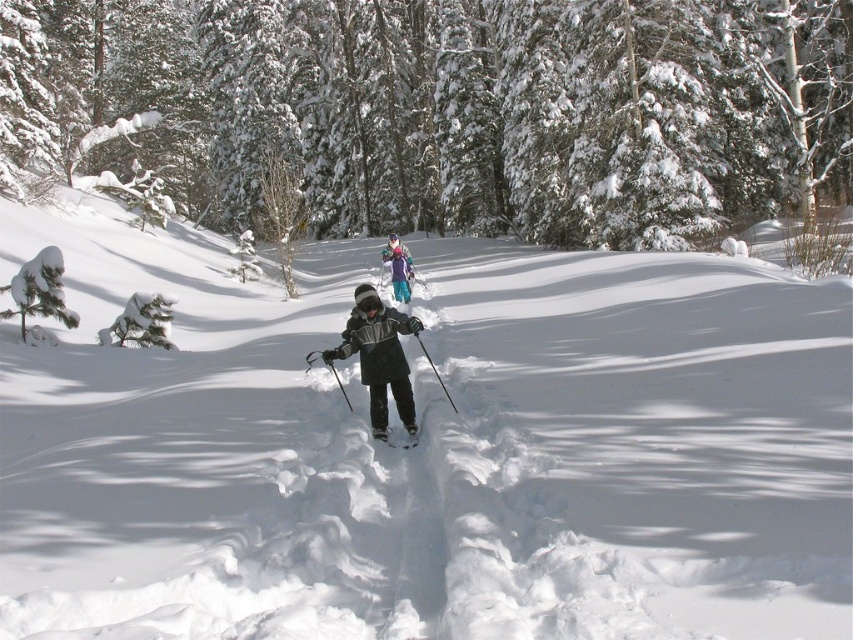
Question: Which point is farther from the camera taking this photo?

Choices:
 (A) (567, 86)
 (B) (387, 435)

Answer: (A)

Question: Does dark gray fleece jacket at center have a larger size compared to white matte ski at center?

Choices:
 (A) no
 (B) yes

Answer: (B)

Question: Is green textured pine tree at upper center positioned before white matte snowshoe at center?

Choices:
 (A) yes
 (B) no

Answer: (B)

Question: Which object appears closest to the camera in this image?

Choices:
 (A) white matte snowshoe at center
 (B) dark gray fleece jacket at center
 (C) white snow ski slope at center
 (D) purple fleece jacket at center

Answer: (C)

Question: Which point is farther from the camera taking this photo?

Choices:
 (A) (386, 428)
 (B) (389, 252)
 (C) (483, 330)
 (D) (404, 436)

Answer: (B)

Question: Is white matte ski at center to the left of white matte snowshoe at center from the viewer's perspective?

Choices:
 (A) no
 (B) yes

Answer: (A)